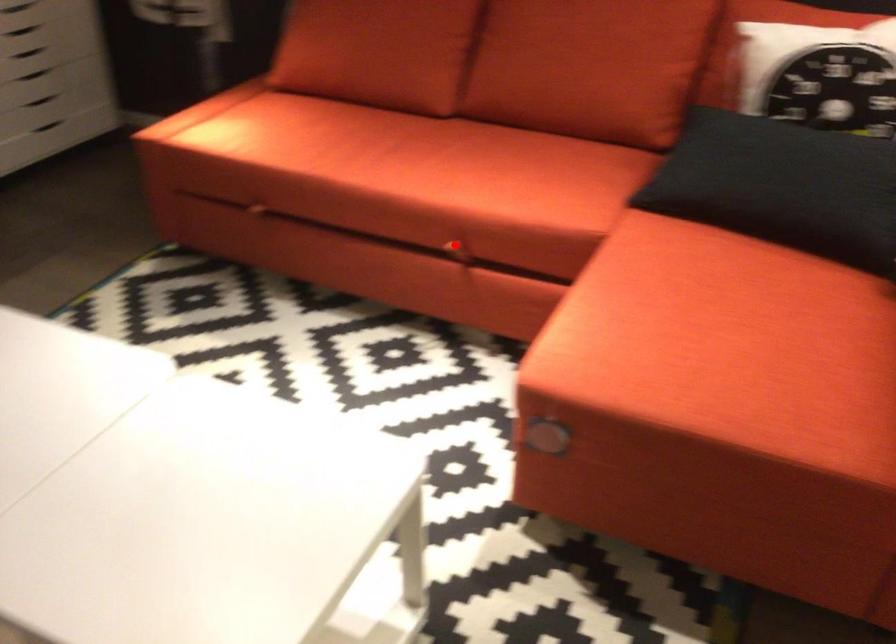
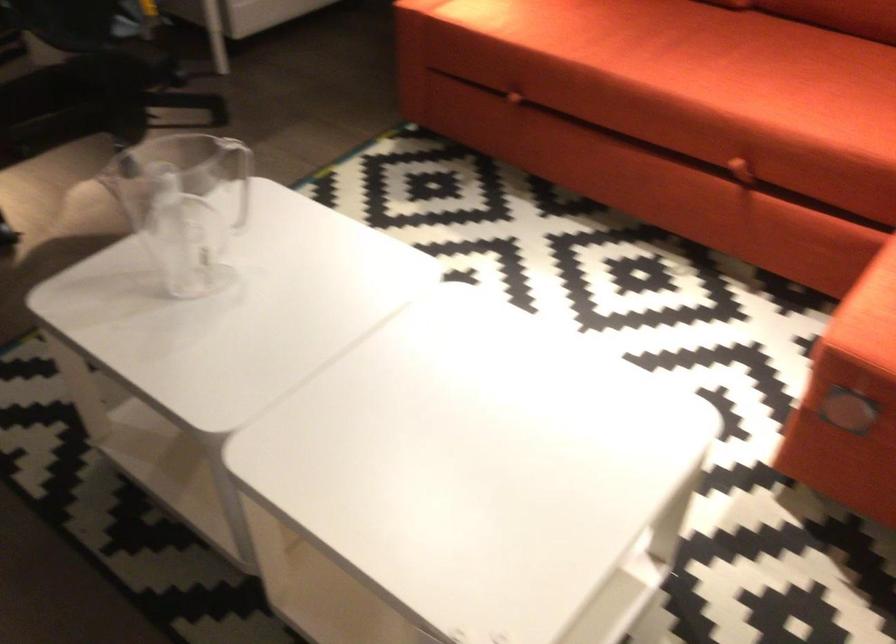
Question: I am providing you with two images of the same scene from different viewpoints. A red point is shown in image1. For the corresponding object point in image2, is it positioned nearer or farther from the camera?

Choices:
 (A) Nearer
 (B) Farther

Answer: (A)